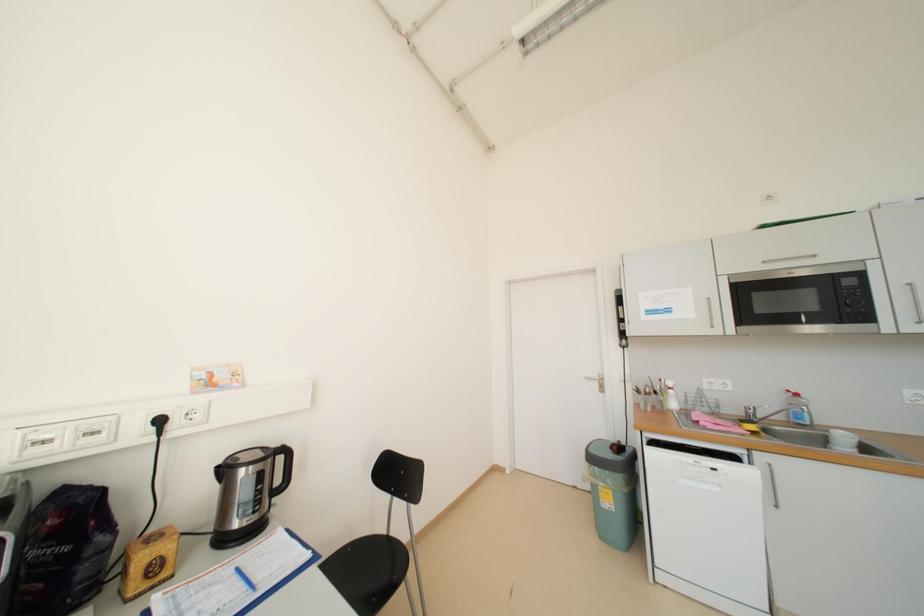
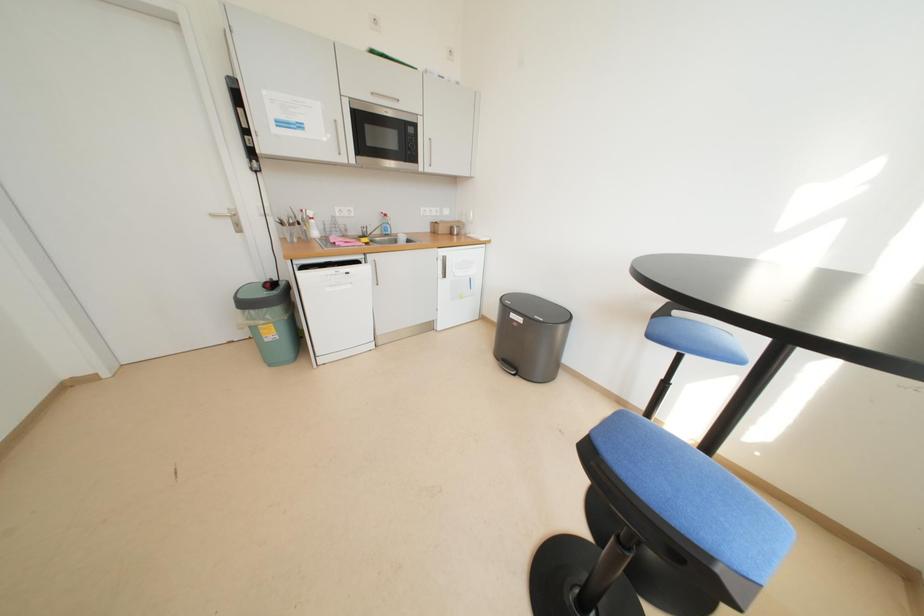
How did the camera likely rotate?

The camera rotated toward right-down.